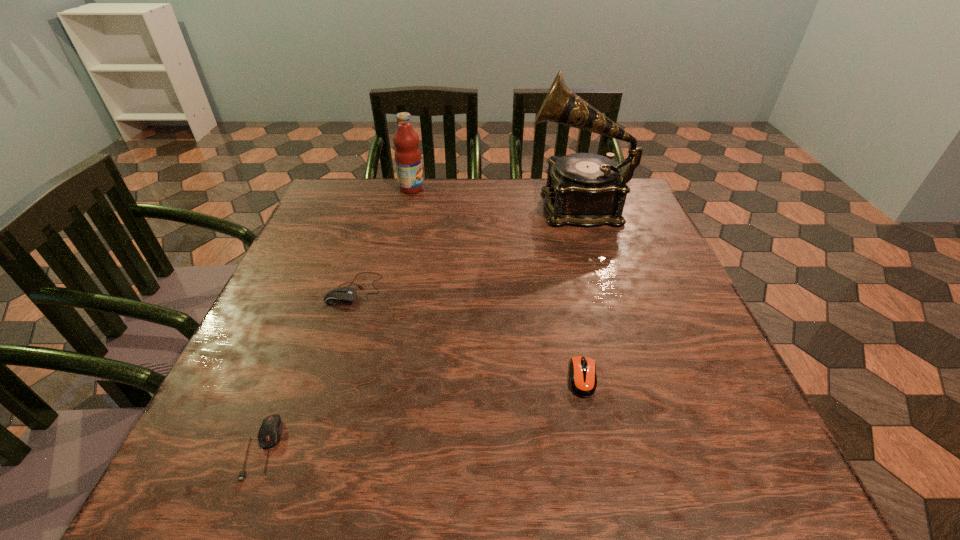
Locate an element on the screen. The width and height of the screenshot is (960, 540). free space that satisfies the following two spatial constraints: 1. on the back side of the nearest mouse; 2. on the left side of the second nearest mouse is located at coordinates (290, 377).

Locate an element on the screen. free space that satisfies the following two spatial constraints: 1. on the horn of the tallest object; 2. on the front side of the rightmost mouse is located at coordinates (632, 377).

Where is `vacant region that satisfies the following two spatial constraints: 1. on the front label of the fourth shortest object; 2. on the right side of the fourth farthest object`? This screenshot has height=540, width=960. vacant region that satisfies the following two spatial constraints: 1. on the front label of the fourth shortest object; 2. on the right side of the fourth farthest object is located at coordinates (368, 377).